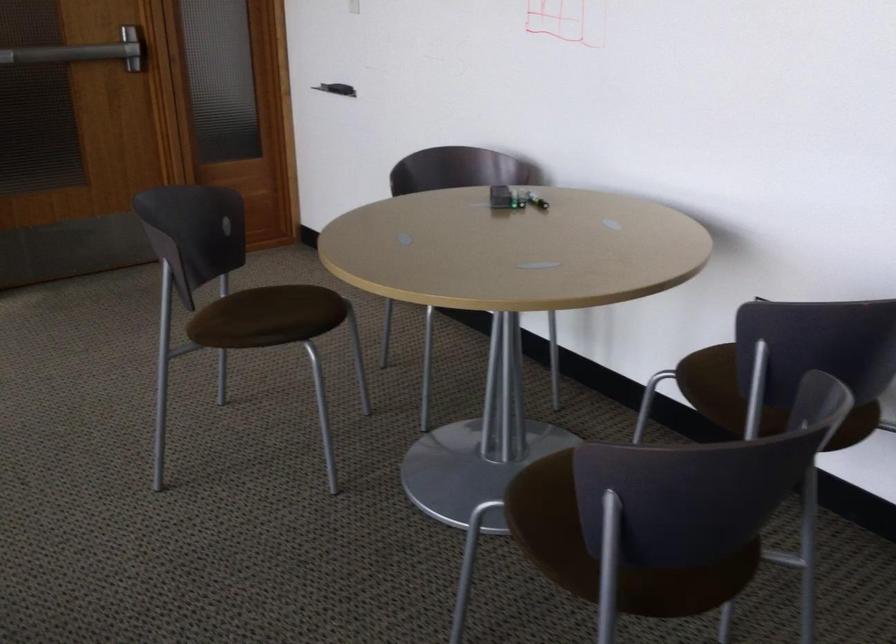
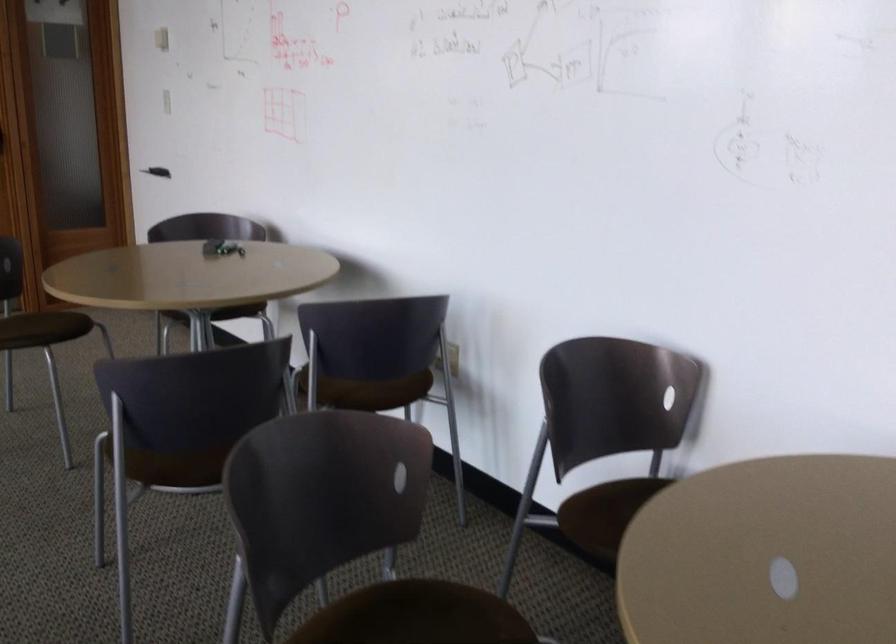
Question: I am providing you with two images of the same scene from different viewpoints. After the viewpoint changes to image2, which objects are now occluded?

Choices:
 (A) set of keys
 (B) white light switch
 (C) green battery
 (D) white plate

Answer: (C)